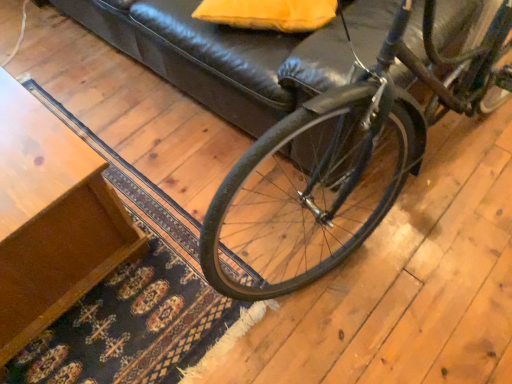
Question: Is wooden table at lower left oriented towards matte yellow pillow at upper center?

Choices:
 (A) yes
 (B) no

Answer: (B)

Question: Is wooden table at lower left surrounding matte yellow pillow at upper center?

Choices:
 (A) no
 (B) yes

Answer: (A)

Question: From a real-world perspective, is wooden table at lower left physically below matte yellow pillow at upper center?

Choices:
 (A) yes
 (B) no

Answer: (A)

Question: From the image's perspective, is wooden table at lower left below matte yellow pillow at upper center?

Choices:
 (A) yes
 (B) no

Answer: (A)

Question: Considering the relative positions of wooden table at lower left and matte yellow pillow at upper center in the image provided, is wooden table at lower left to the right of matte yellow pillow at upper center from the viewer's perspective?

Choices:
 (A) no
 (B) yes

Answer: (A)

Question: Can you confirm if wooden table at lower left is wider than matte yellow pillow at upper center?

Choices:
 (A) no
 (B) yes

Answer: (B)

Question: Does matte yellow pillow at upper center lie behind wooden table at lower left?

Choices:
 (A) yes
 (B) no

Answer: (A)

Question: Is wooden table at lower left a part of matte yellow pillow at upper center?

Choices:
 (A) no
 (B) yes

Answer: (A)

Question: Is matte yellow pillow at upper center bigger than wooden table at lower left?

Choices:
 (A) yes
 (B) no

Answer: (B)

Question: From the image's perspective, is matte yellow pillow at upper center on wooden table at lower left?

Choices:
 (A) yes
 (B) no

Answer: (A)

Question: Is matte yellow pillow at upper center at the left side of wooden table at lower left?

Choices:
 (A) yes
 (B) no

Answer: (B)

Question: Can you confirm if matte yellow pillow at upper center is positioned to the right of wooden table at lower left?

Choices:
 (A) yes
 (B) no

Answer: (A)

Question: Is shiny black bicycle at center aimed at wooden table at lower left?

Choices:
 (A) no
 (B) yes

Answer: (A)